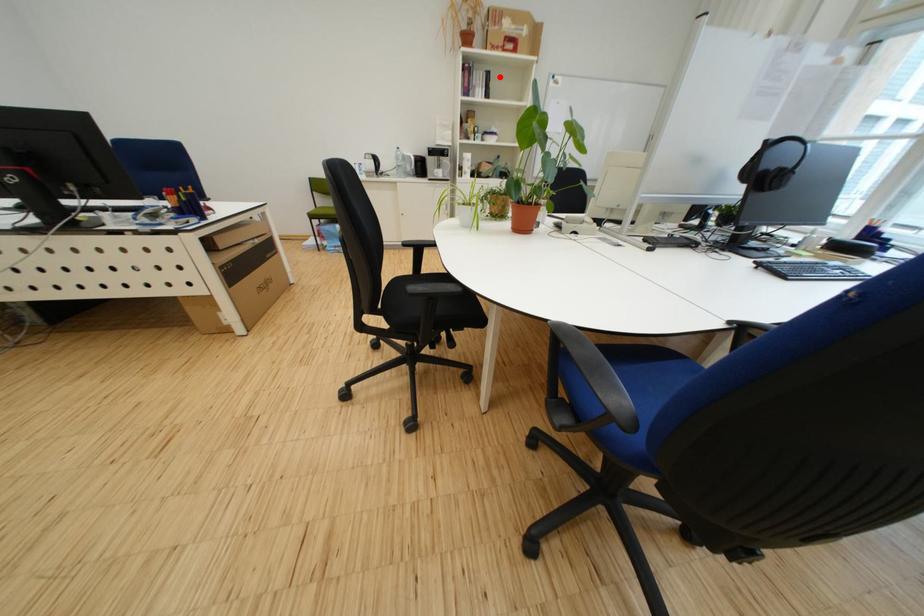
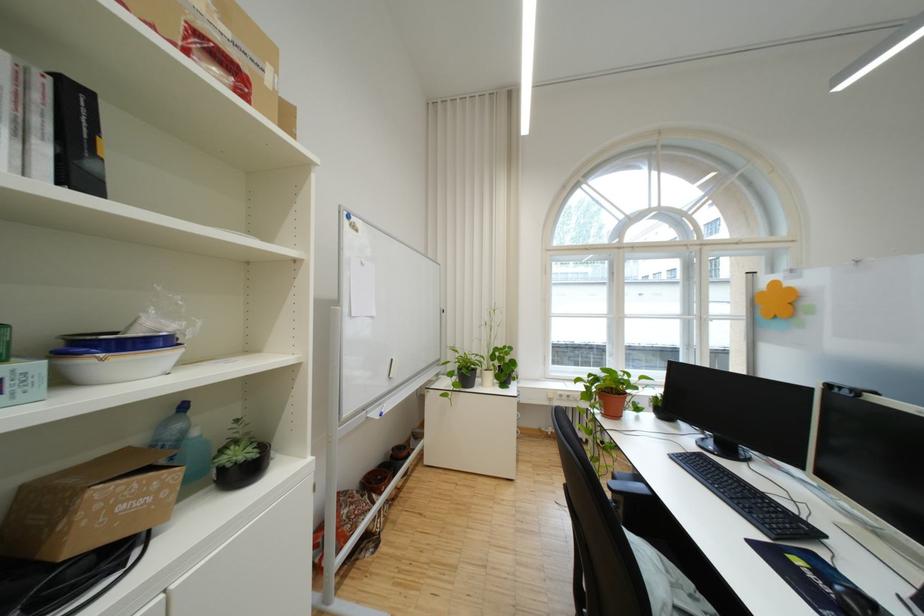
In the second image, find the point that corresponds to the highlighted location in the first image.

(88, 100)